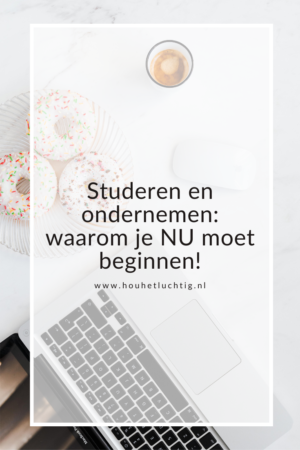
Where is `cup`? cup is located at coordinates (178, 70).